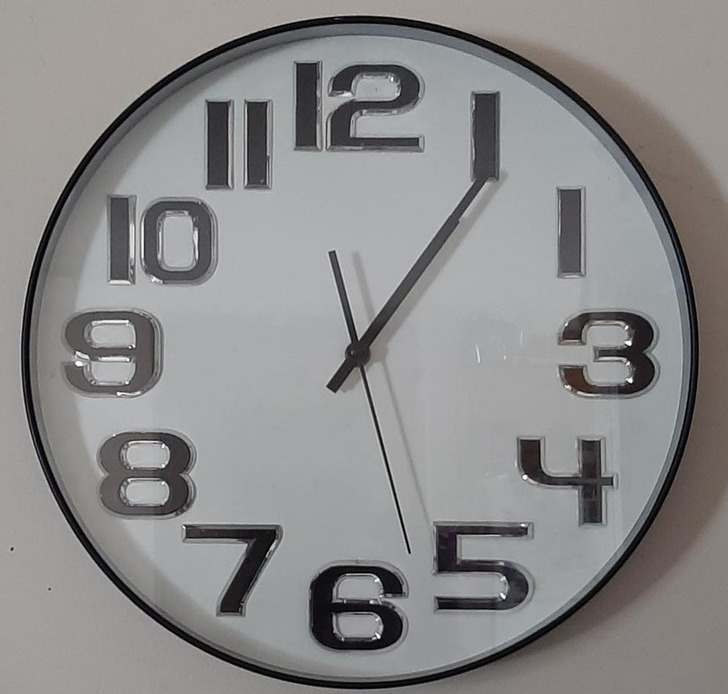
Where is `clock hands`? clock hands is located at coordinates click(x=453, y=228), click(x=459, y=207), click(x=351, y=323).